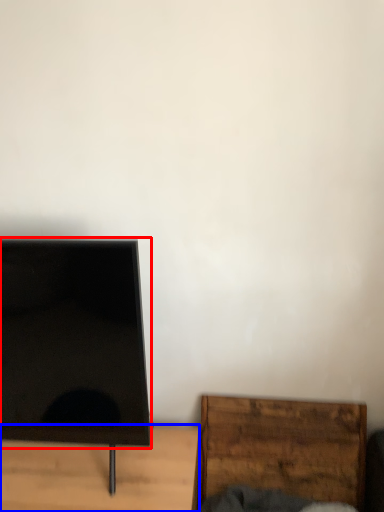
Question: Which point is further to the camera, screen (highlighted by a red box) or furniture (highlighted by a blue box)?

Choices:
 (A) screen
 (B) furniture

Answer: (B)